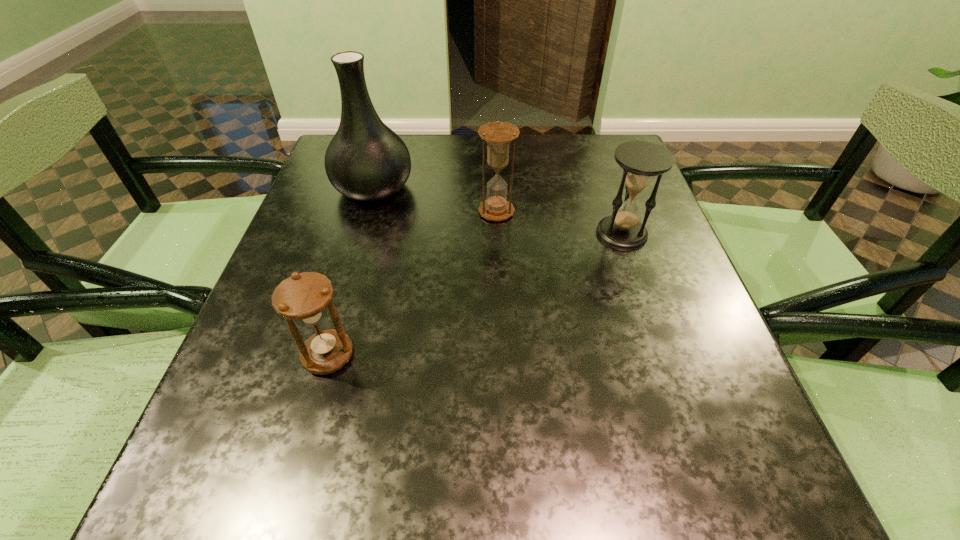
The width and height of the screenshot is (960, 540). I want to click on vase that is at the left edge, so click(366, 161).

Locate an element on the screen. hourglass at the left edge is located at coordinates click(304, 297).

Find the location of a particular element. object at the right edge is located at coordinates (641, 161).

This screenshot has height=540, width=960. Find the location of `object present at the far left corner`. object present at the far left corner is located at coordinates (366, 161).

The width and height of the screenshot is (960, 540). What are the coordinates of `free space at the far edge of the desktop` in the screenshot? It's located at (569, 167).

This screenshot has height=540, width=960. In order to click on vacant space at the near edge in this screenshot , I will do click(661, 511).

The width and height of the screenshot is (960, 540). In the image, there is a desktop. What are the coordinates of `free space at the left edge` in the screenshot? It's located at (309, 215).

Where is `free location at the right edge`? The width and height of the screenshot is (960, 540). free location at the right edge is located at coordinates (649, 294).

Locate an element on the screen. This screenshot has height=540, width=960. vacant area at the far left corner is located at coordinates (324, 180).

Locate an element on the screen. free space at the far right corner of the desktop is located at coordinates (581, 134).